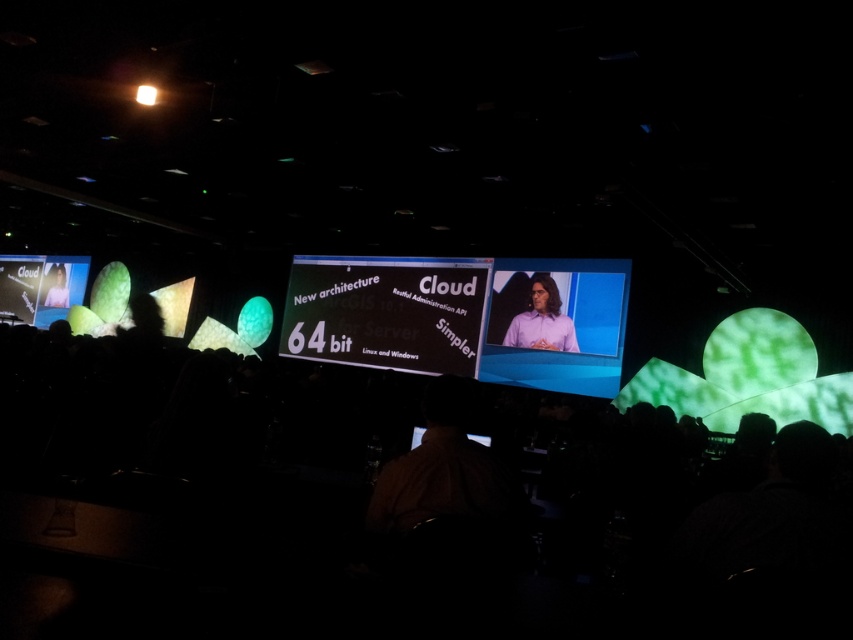
You are an attendee at the conference and want to take a photo of both the matte black screen at left and the matte black laptop at left. Since the screen and laptop are both on the left side, where exactly should you position yourself to capture both in your camera frame?

To capture both the matte black screen at left and the matte black laptop at left in your camera frame, position yourself to the right side of the scene. Since the matte black screen at left is located above the matte black laptop at left, standing to the right allows you to see both objects positioned to your left while maintaining their vertical arrangement in the frame.

You are an attendee at the presentation and need to take notes on the laptop. Which object is closer to the left side of the stage, the matte black screen at left or the matte black laptop at left?

The matte black screen at left is positioned on the left side of the matte black laptop at left, so the matte black screen at left is closer to the left side of the stage.

You are an attendee sitting in the front row of the conference. You notice two points on the stage screen labeled as point 1 and point 2. The first point is at coordinates (219, 548) and the second at (544, 280). If you want to point out the one that is closer to you, which coordinate should you indicate?

Point 1 at coordinates (219, 548) is closer to the viewer than point 2 at (544, 280).